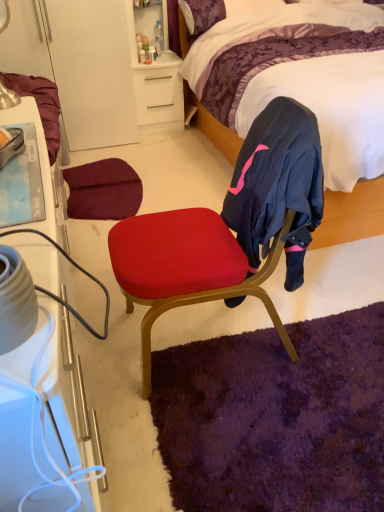
Question: Would you consider velvet purple bed at upper right to be distant from purple shag rug at lower center?

Choices:
 (A) yes
 (B) no

Answer: (A)

Question: Does velvet purple bed at upper right have a larger size compared to purple shag rug at lower center?

Choices:
 (A) no
 (B) yes

Answer: (B)

Question: Considering the relative sizes of velvet purple bed at upper right and purple shag rug at lower center in the image provided, is velvet purple bed at upper right taller than purple shag rug at lower center?

Choices:
 (A) yes
 (B) no

Answer: (A)

Question: Is velvet purple bed at upper right aimed at purple shag rug at lower center?

Choices:
 (A) yes
 (B) no

Answer: (A)

Question: From a real-world perspective, is velvet purple bed at upper right below purple shag rug at lower center?

Choices:
 (A) no
 (B) yes

Answer: (A)

Question: Does velvet purple bed at upper right have a greater width compared to purple shag rug at lower center?

Choices:
 (A) no
 (B) yes

Answer: (B)

Question: Is brushed metal table lamp at upper left with purple shag rug at lower center?

Choices:
 (A) no
 (B) yes

Answer: (A)

Question: Is brushed metal table lamp at upper left wider than purple shag rug at lower center?

Choices:
 (A) no
 (B) yes

Answer: (A)

Question: From a real-world perspective, is brushed metal table lamp at upper left located higher than purple shag rug at lower center?

Choices:
 (A) yes
 (B) no

Answer: (A)

Question: Does brushed metal table lamp at upper left come behind purple shag rug at lower center?

Choices:
 (A) no
 (B) yes

Answer: (B)

Question: Can you confirm if brushed metal table lamp at upper left is bigger than purple shag rug at lower center?

Choices:
 (A) no
 (B) yes

Answer: (A)

Question: Can you confirm if brushed metal table lamp at upper left is positioned to the left of purple shag rug at lower center?

Choices:
 (A) no
 (B) yes

Answer: (B)

Question: From the image's perspective, does velvet red chair at center appear higher than white matte desk at upper center?

Choices:
 (A) no
 (B) yes

Answer: (A)